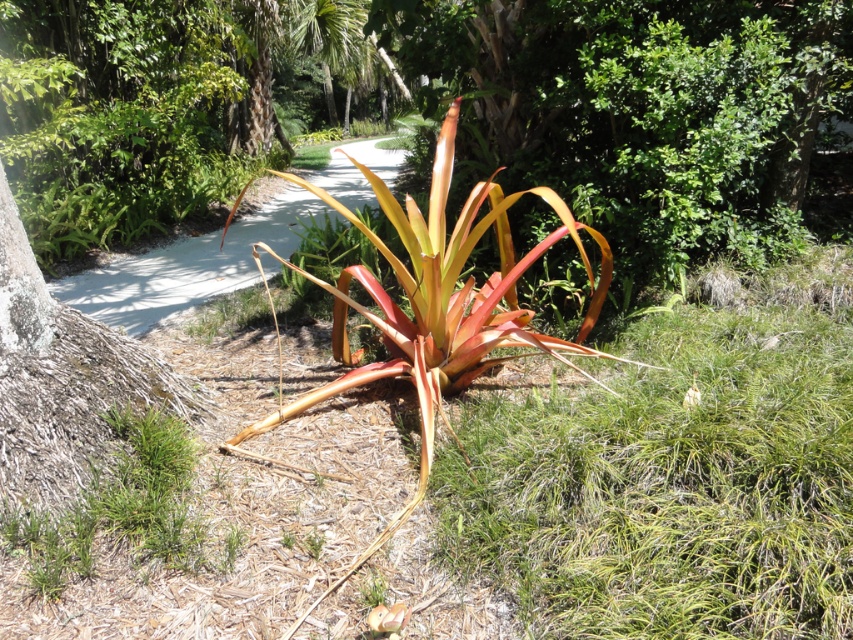
Is the position of white concrete path at center more distant than that of matte orange leaf at center?

Yes, white concrete path at center is further from the viewer.

Who is more forward, (112, 291) or (380, 612)?

Point (380, 612) is more forward.

Is point (299, 202) positioned behind point (383, 625)?

Yes.

I want to click on white concrete path at center, so click(x=184, y=268).

Does white concrete path at center have a greater width compared to white fluffy flower at center?

Yes.

Does white concrete path at center have a lesser width compared to white fluffy flower at center?

In fact, white concrete path at center might be wider than white fluffy flower at center.

Between point (135, 320) and point (695, 394), which one is positioned in front?

Positioned in front is point (695, 394).

This screenshot has width=853, height=640. In order to click on white concrete path at center in this screenshot , I will do `click(184, 268)`.

How far apart are matte orange leaf at center and white fluffy flower at center?

matte orange leaf at center and white fluffy flower at center are 1.46 meters apart from each other.

Measure the distance between matte orange leaf at center and camera.

matte orange leaf at center and camera are 2.06 meters apart.

Is point (374, 611) less distant than point (688, 406)?

Yes.

Locate an element on the screen. The height and width of the screenshot is (640, 853). matte orange leaf at center is located at coordinates (387, 618).